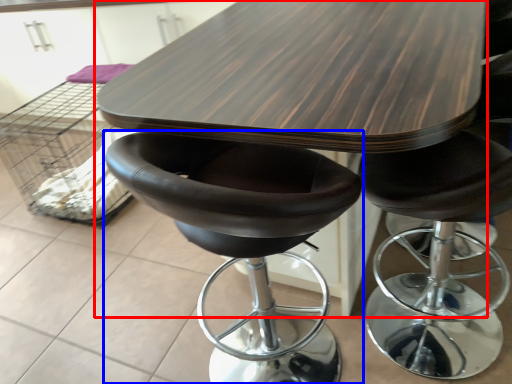
Question: Which of the following is the closest to the observer, table (highlighted by a red box) or chair (highlighted by a blue box)?

Choices:
 (A) table
 (B) chair

Answer: (B)